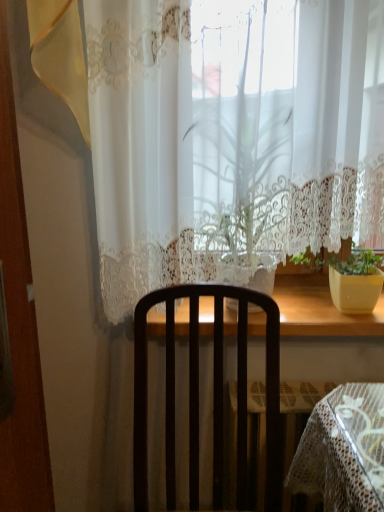
You are a GUI agent. You are given a task and a screenshot of the screen. Output one action in this format:
    pyautogui.click(x=<x>, y=<y>)
    Task: Click on the yellow matte pot at right
    The width and height of the screenshot is (384, 512).
    Given the screenshot: What is the action you would take?
    pyautogui.click(x=349, y=277)

What do you see at coordinates (349, 277) in the screenshot? This screenshot has height=512, width=384. I see `yellow matte pot at right` at bounding box center [349, 277].

I want to click on yellow matte pot at right, so click(x=349, y=277).